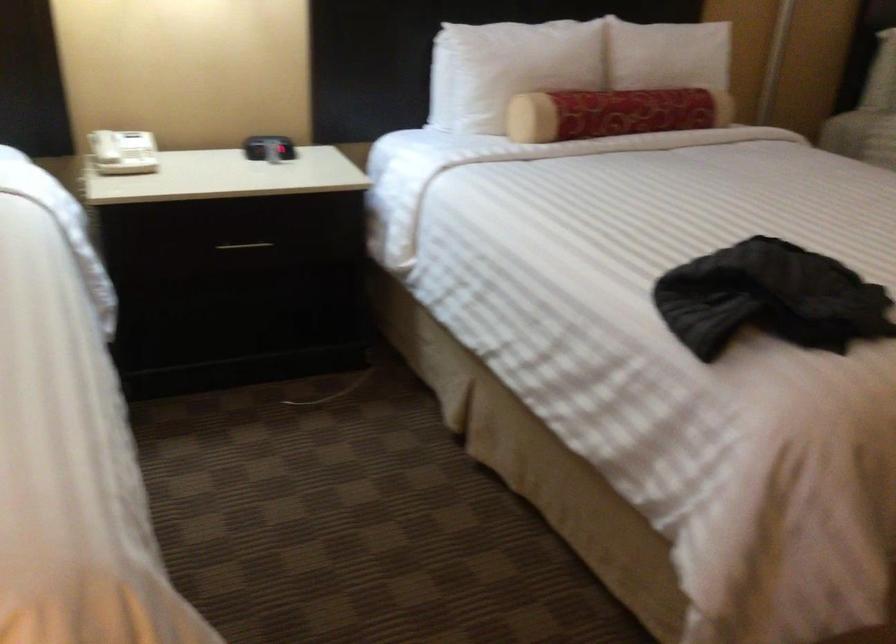
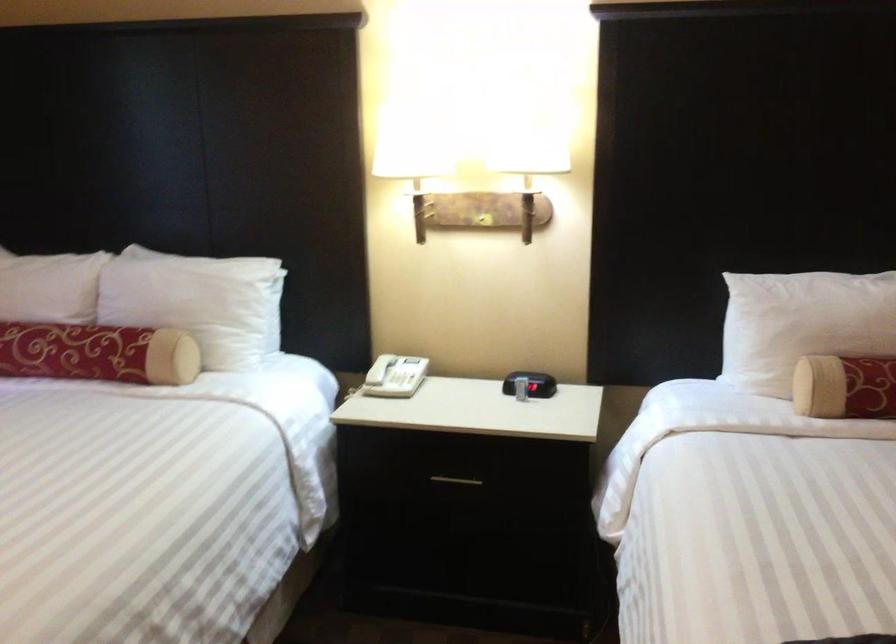
Where in the second image is the point corresponding to pixel 242 249 from the first image?

(455, 480)